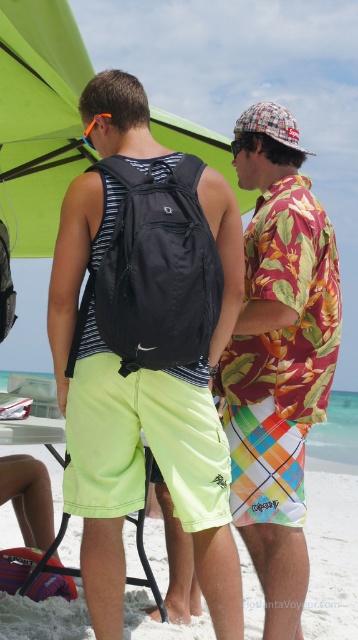
You are a photographer setting up equipment on the beach. You need to place a small tripod between the matte black backpack at center and the green fabric umbrella at upper center. Based on their sizes, which object should the tripod be closer to to ensure stability?

The matte black backpack at center is much taller than the green fabric umbrella at upper center, so the tripod should be placed closer to the matte black backpack at center for better stability due to its height providing a more solid base.

You are standing on the white sandy beach at lower center and want to pick up the matte black backpack at center. Which direction should you move to reach it?

The matte black backpack at center is to the left of the white sandy beach at lower center, so you should move to your left to reach it.